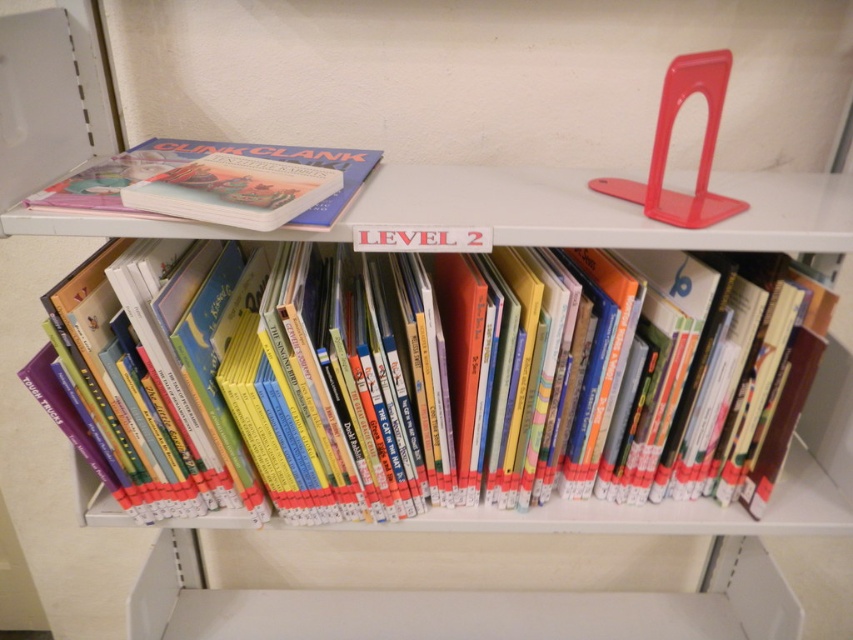
Consider the image. You are organizing books on a bookshelf and need to place a new book that is 20 centimeters wide. There is a space between the hardcover books at center and the matte hardcover book at upper left. Can the new book fit in that space?

The space between the hardcover books at center and the matte hardcover book at upper left is 21.76 centimeters. Since the new book is 20 centimeters wide, it can fit in that space.

You are standing in front of the bookshelf labeled LEVEL 2 and want to reach two specific points on the shelf. Which of the two points, point (660,456) or point (210,144), is closer to you?

Point (660,456) is closer to the viewer than point (210,144).

You are organizing books on a bookshelf labeled LEVEL 2. You have a new book to place and need to ensure it fits between the hardcover books at center. What is the exact location coordinates where you should place the new book?

The hardcover books at center are located at point (416, 385). Therefore, you should place the new book near those coordinates to ensure it fits between them.